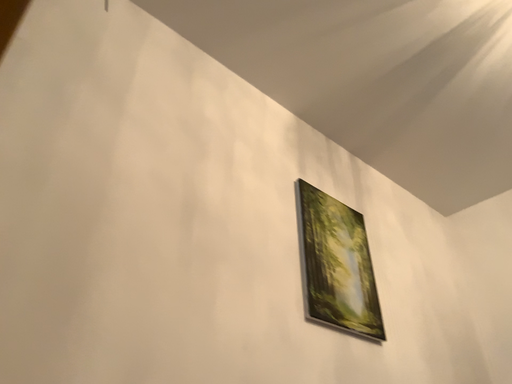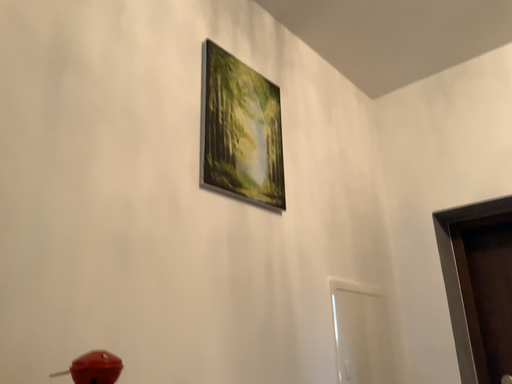
Question: How did the camera likely rotate when shooting the video?

Choices:
 (A) rotated downward
 (B) rotated upward

Answer: (A)